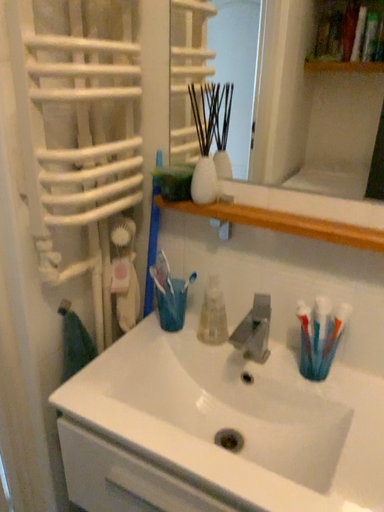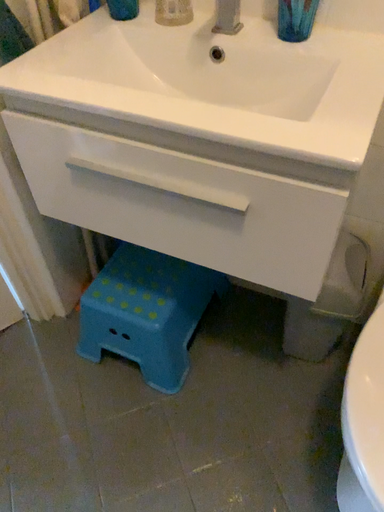
Question: How did the camera likely rotate when shooting the video?

Choices:
 (A) rotated upward
 (B) rotated downward

Answer: (B)